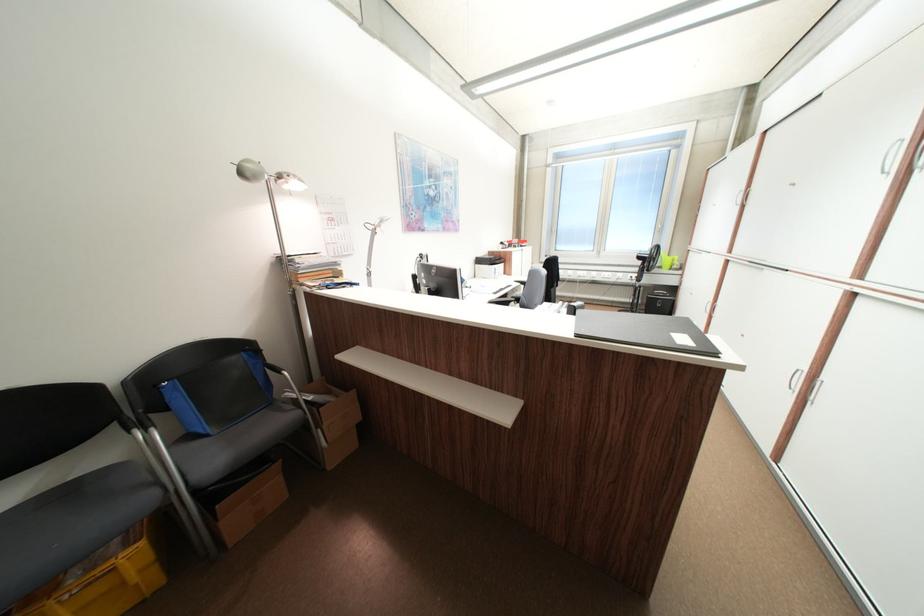
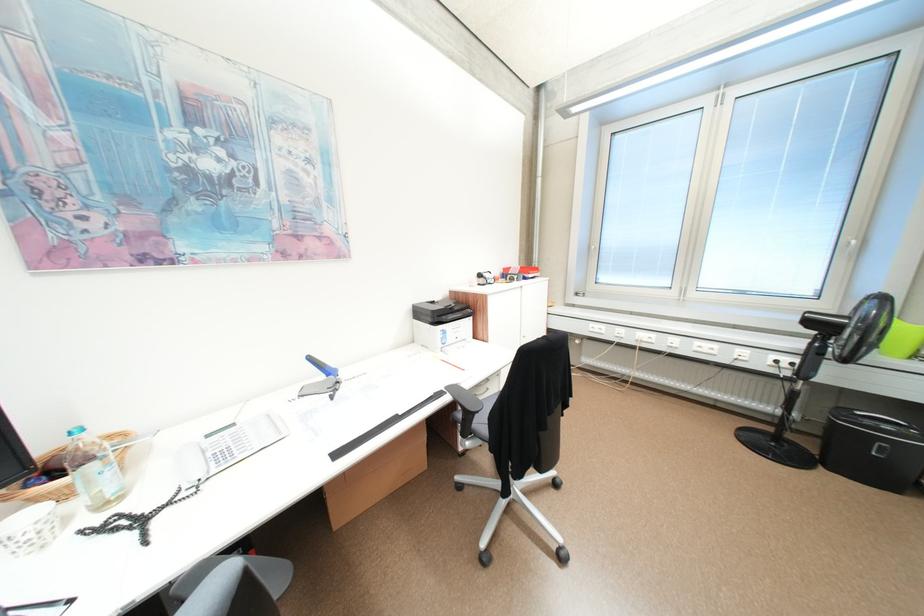
Find the pixel in the second image that matches point 677,268 in the first image.

(917, 352)